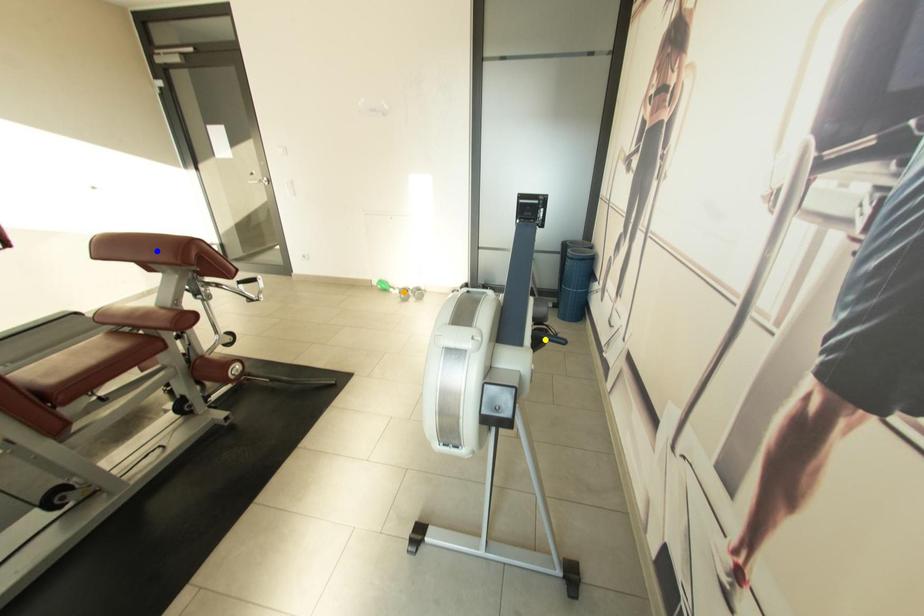
Order these from nearest to farthest:
- blue point
- orange point
- yellow point

orange point < yellow point < blue point